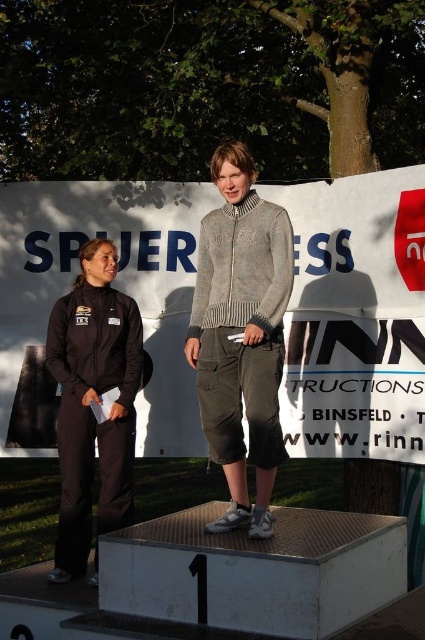
Between knitted sweater at center and black matte tracksuit at left, which one is positioned higher?

knitted sweater at center is above.

Can you confirm if knitted sweater at center is positioned below black matte tracksuit at left?

No, knitted sweater at center is not below black matte tracksuit at left.

Is point (260, 524) closer to camera compared to point (101, 506)?

Yes, it is in front of point (101, 506).

In order to click on knitted sweater at center in this screenshot , I will do `click(240, 333)`.